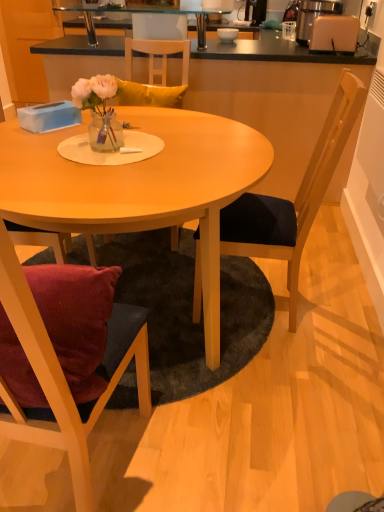
Where is `vacant space to the left of translucent glass vase at center`? vacant space to the left of translucent glass vase at center is located at coordinates [x=43, y=147].